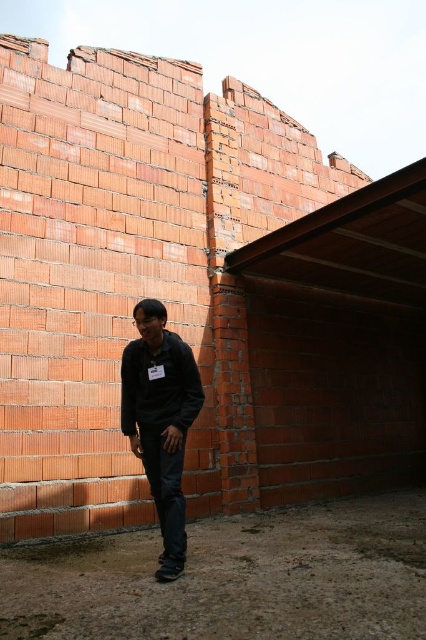
Between black matte jacket at center and dark matte sweatshirt at center, which one has less height?

Standing shorter between the two is dark matte sweatshirt at center.

Which is behind, point (173, 509) or point (169, 332)?

Point (169, 332)

This screenshot has width=426, height=640. What are the coordinates of `black matte jacket at center` in the screenshot? It's located at (161, 420).